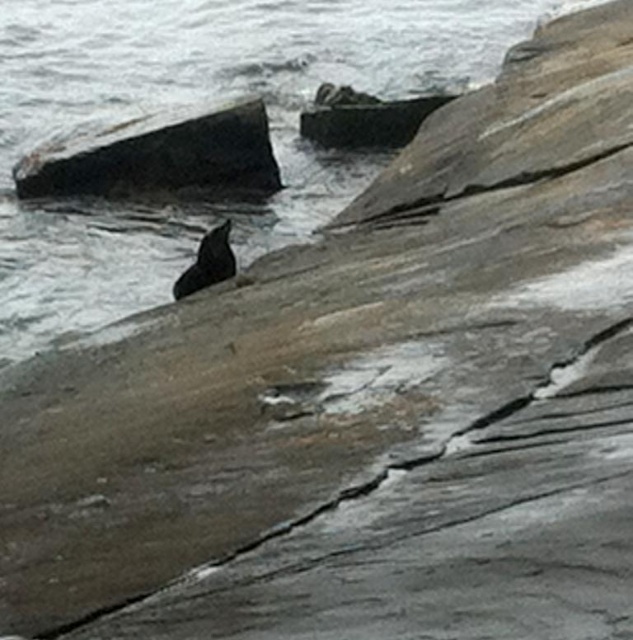
Can you confirm if smooth dark gray rock at upper left is bigger than smooth gray rock at upper center?

Correct, smooth dark gray rock at upper left is larger in size than smooth gray rock at upper center.

Which is in front, point (65, 156) or point (330, 132)?

Positioned in front is point (65, 156).

You are a GUI agent. You are given a task and a screenshot of the screen. Output one action in this format:
    pyautogui.click(x=<x>, y=<y>)
    Task: Click on the smooth dark gray rock at upper left
    Image resolution: width=633 pixels, height=640 pixels.
    Given the screenshot: What is the action you would take?
    160,154

Where is `smooth dark gray rock at upper left`? Image resolution: width=633 pixels, height=640 pixels. smooth dark gray rock at upper left is located at coordinates click(x=160, y=154).

Consider the image. Who is lower down, smooth gray rock at upper center or smooth black seal at center?

Positioned lower is smooth black seal at center.

Based on the photo, who is more forward, (392, 138) or (179, 296)?

Positioned in front is point (179, 296).

Find the location of a particular element. Image resolution: width=633 pixels, height=640 pixels. smooth gray rock at upper center is located at coordinates (365, 118).

Does smooth dark gray rock at upper left have a larger size compared to smooth black seal at center?

Yes.

Does point (16, 177) come in front of point (203, 280)?

No, (16, 177) is behind (203, 280).

The image size is (633, 640). I want to click on smooth dark gray rock at upper left, so (160, 154).